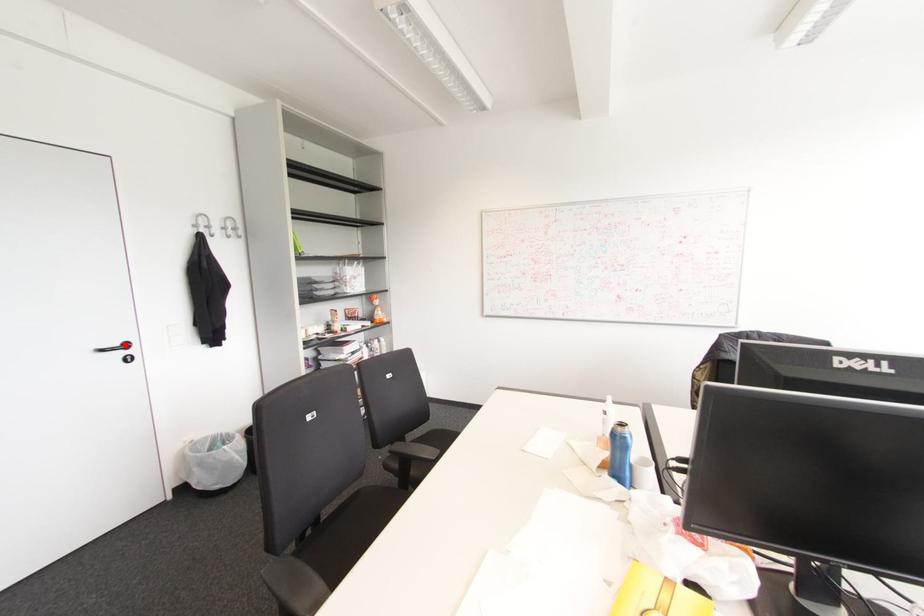
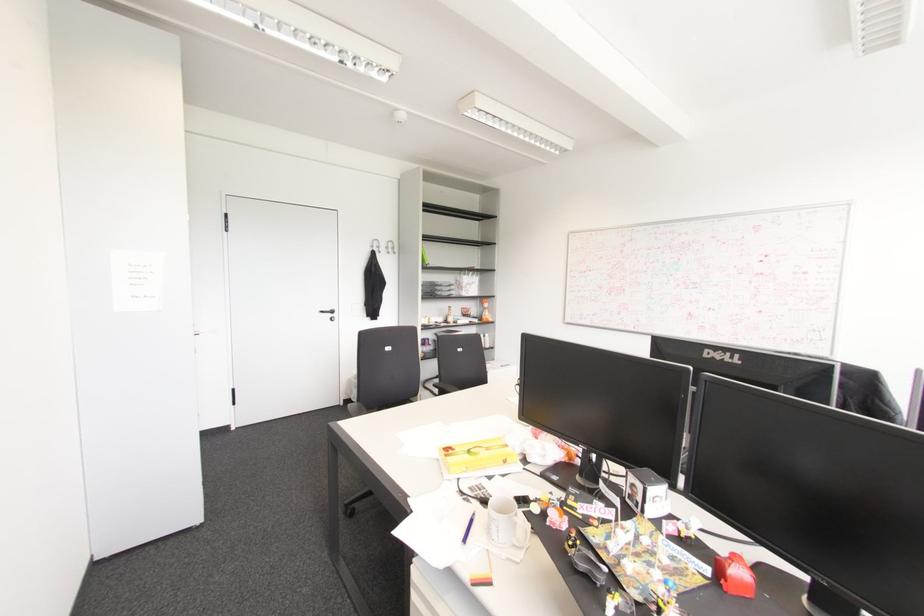
In the second image, find the point that corresponds to the highlighted location in the first image.

(332, 310)